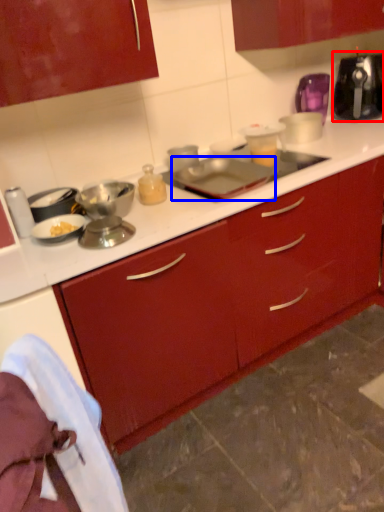
Question: Which object appears closest to the camera in this image, kitchen appliance (highlighted by a red box) or appliance (highlighted by a blue box)?

Choices:
 (A) kitchen appliance
 (B) appliance

Answer: (B)